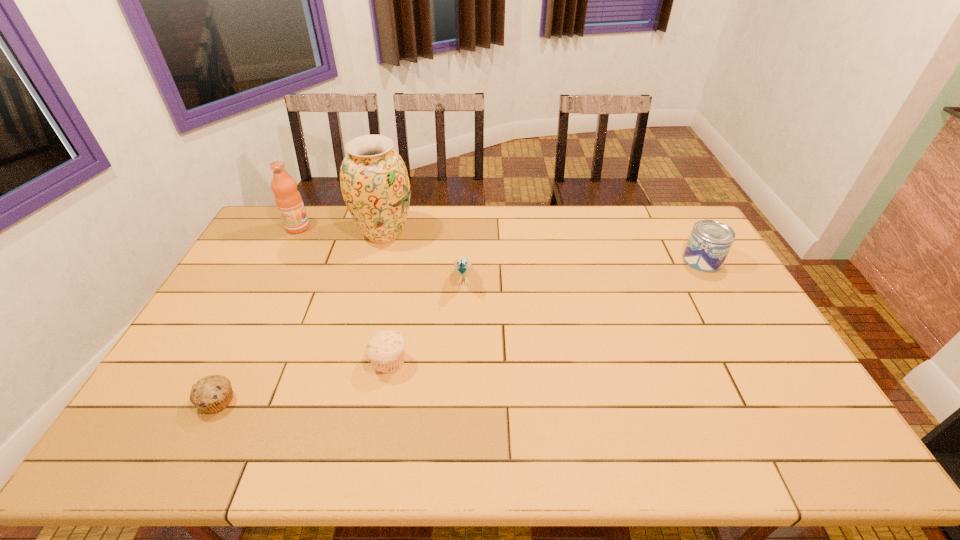
Where is `vacant area between the left muffin and the tallest object`? Image resolution: width=960 pixels, height=540 pixels. vacant area between the left muffin and the tallest object is located at coordinates (300, 317).

Identify the location of free space between the fifth shortest object and the bird. (380, 253).

The image size is (960, 540). Find the location of `vacant space that is in between the fifth tallest object and the tallest object`. vacant space that is in between the fifth tallest object and the tallest object is located at coordinates (387, 298).

Identify the location of vacant space that's between the can and the bird. (583, 269).

Identify the location of unoccupied area between the second tallest object and the fifth object from left to right. (380, 253).

You are a GUI agent. You are given a task and a screenshot of the screen. Output one action in this format:
    pyautogui.click(x=<x>, y=<y>)
    Task: Click on the free area in between the fourth tallest object and the fruit juice
    Image resolution: width=960 pixels, height=540 pixels.
    Given the screenshot: What is the action you would take?
    pyautogui.click(x=500, y=244)

Choose which object is the second nearest neighbor to the tallest object. Please provide its 2D coordinates. Your answer should be formatted as a tuple, i.e. [(x, y)], where the tuple contains the x and y coordinates of a point satisfying the conditions above.

[(289, 202)]

Locate an element on the screen. This screenshot has height=540, width=960. object that is the second nearest to the fifth tallest object is located at coordinates (211, 394).

This screenshot has width=960, height=540. Identify the location of vacant region that satisfies the following two spatial constraints: 1. on the label side of the fruit juice; 2. on the back side of the tallest object. (295, 234).

Where is `free space that satisfies the following two spatial constraints: 1. on the label side of the fruit juice; 2. on the back side of the right muffin`? free space that satisfies the following two spatial constraints: 1. on the label side of the fruit juice; 2. on the back side of the right muffin is located at coordinates (227, 363).